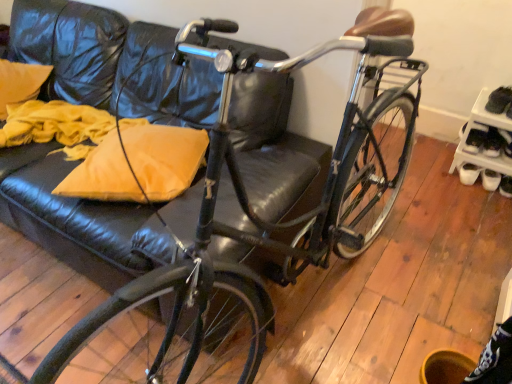
Find the location of a particular element. free space to the left of white plastic shoe rack at right is located at coordinates (430, 167).